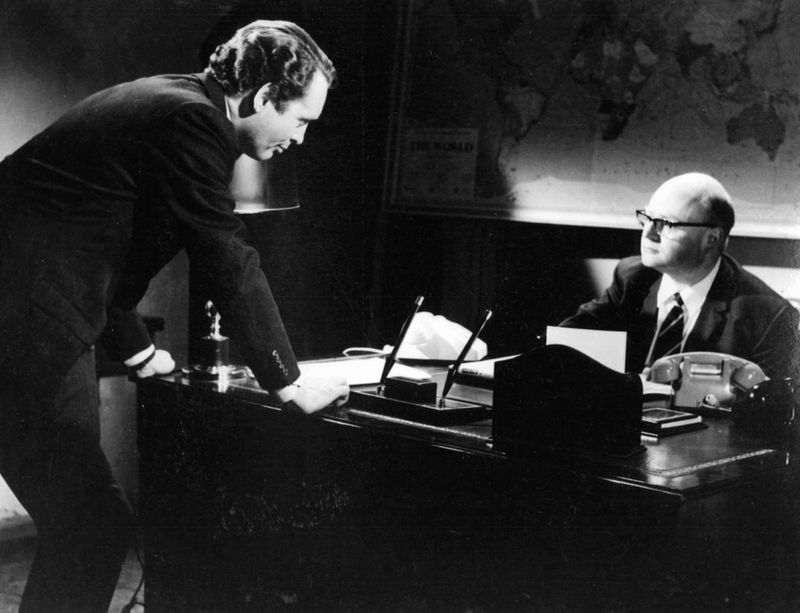
I want to click on map, so click(x=661, y=112).